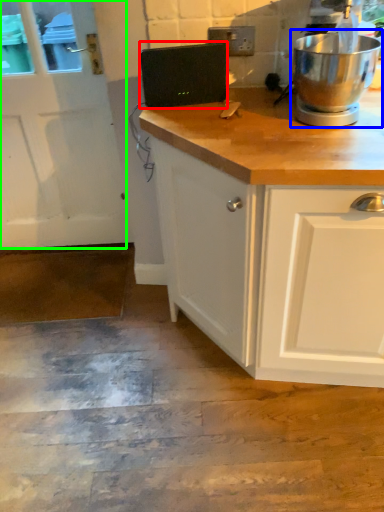
Question: Which object is the farthest from appliance (highlighted by a red box)? Choose among these: home appliance (highlighted by a blue box) or screen door (highlighted by a green box).

Choices:
 (A) home appliance
 (B) screen door

Answer: (B)